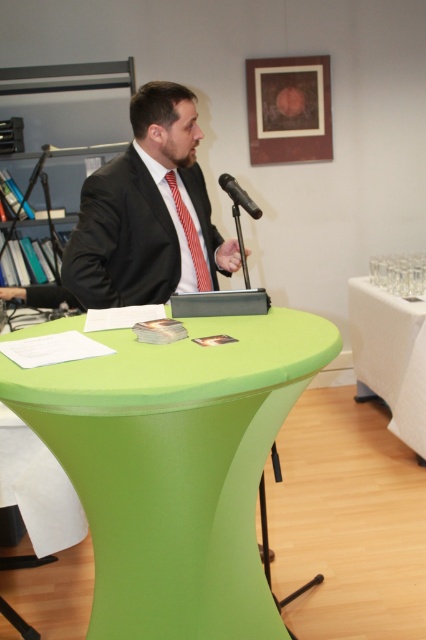
You are a photographer positioned at the entrance of the room. You need to take a photo of the black suit at center. According to the coordinates provided, where should you aim your camera to capture the subject?

The black suit at center is located at coordinates point (146, 211), so you should aim your camera at that position to capture the subject.